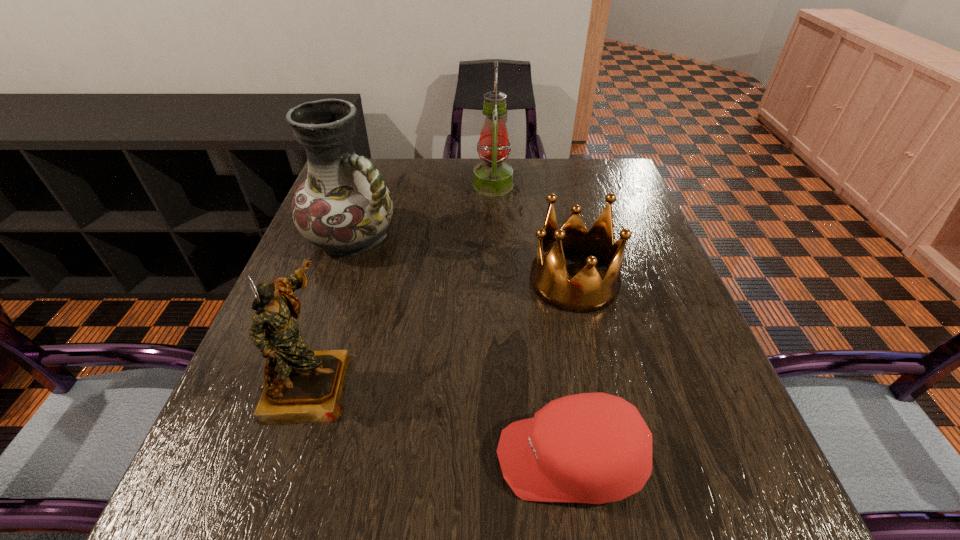
The image size is (960, 540). In the image, there is a desktop. Identify the location of vacant space at the right edge. [706, 402].

Find the location of a particular element. The image size is (960, 540). vacant region at the far left corner of the desktop is located at coordinates (390, 167).

Identify the location of free location at the far right corner. (612, 187).

Where is `free space between the figurine and the farthest object`? The width and height of the screenshot is (960, 540). free space between the figurine and the farthest object is located at coordinates (401, 284).

You are a GUI agent. You are given a task and a screenshot of the screen. Output one action in this format:
    pyautogui.click(x=<x>, y=<y>)
    Task: Click on the free space that is in between the oil lamp and the shortest object
    The image size is (960, 540).
    Given the screenshot: What is the action you would take?
    pyautogui.click(x=532, y=322)

At what (x,y) coordinates should I click in order to perform the action: click on vacant area that lies between the farthest object and the shortest object. Please return your answer as a coordinate pair (x, y). Image resolution: width=960 pixels, height=540 pixels. Looking at the image, I should click on (532, 322).

This screenshot has width=960, height=540. What are the coordinates of `unoccupied area between the cap and the vase` in the screenshot? It's located at (462, 348).

At what (x,y) coordinates should I click in order to perform the action: click on free space that is in between the figurine and the oil lamp. Please return your answer as a coordinate pair (x, y). The width and height of the screenshot is (960, 540). Looking at the image, I should click on (401, 284).

The height and width of the screenshot is (540, 960). Identify the location of unoccupied position between the third shortest object and the vase. (331, 310).

I want to click on free area in between the figurine and the shortest object, so click(x=440, y=421).